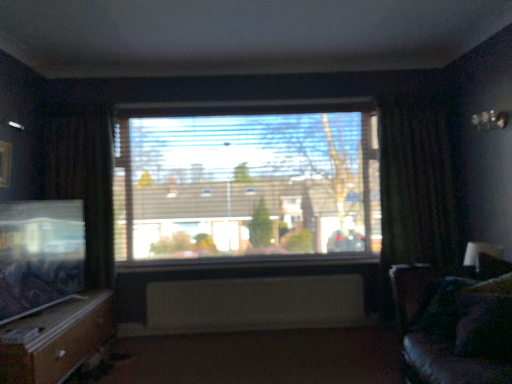
Image resolution: width=512 pixels, height=384 pixels. Identify the location of velvet dark brown couch at right. (428, 339).

In order to face dark brown fabric curtain at left, which is the 1th curtain from left to right, should I rotate leftwards or rightwards?

To face it directly, rotate left by 21.160 degrees.

I want to click on velvet dark blue pillow at lower right, so click(484, 327).

From a real-world perspective, is dark brown fabric curtain at left, which is the 1th curtain from left to right, on dark fabric curtain at right, the first curtain viewed from the right?

Indeed, from a real-world perspective, dark brown fabric curtain at left, which is the 1th curtain from left to right, stands above dark fabric curtain at right, the first curtain viewed from the right.

From the image's perspective, is dark brown fabric curtain at left, which is the 1th curtain from left to right, located beneath dark fabric curtain at right, the first curtain viewed from the right?

Yes, from the image's perspective, dark brown fabric curtain at left, which is the 1th curtain from left to right, is beneath dark fabric curtain at right, the first curtain viewed from the right.

Considering the sizes of objects dark brown fabric curtain at left, which is counted as the 2th curtain, starting from the right, and dark fabric curtain at right, the first curtain viewed from the right, in the image provided, who is thinner, dark brown fabric curtain at left, which is counted as the 2th curtain, starting from the right, or dark fabric curtain at right, the first curtain viewed from the right,?

Thinner between the two is dark fabric curtain at right, the first curtain viewed from the right.

Is dark brown fabric curtain at left, which is the 1th curtain from left to right, further to camera compared to dark fabric curtain at right, the first curtain viewed from the right?

No, dark brown fabric curtain at left, which is the 1th curtain from left to right, is closer to the viewer.

The width and height of the screenshot is (512, 384). What are the coordinates of `window on the right side of white painted wood at center` in the screenshot? It's located at (x=246, y=181).

In the scene shown: From a real-world perspective, which object rests below the other?

white painted wood at center is physically lower.

Is white painted wood at center aimed at transparent glass window at center?

Yes, white painted wood at center is oriented towards transparent glass window at center.

Is transparent glass window at center located within white painted wood at center?

No, transparent glass window at center is not a part of white painted wood at center.

Considering the positions of point (103, 321) and point (97, 278), is point (103, 321) closer or farther from the camera than point (97, 278)?

Point (103, 321) appears to be closer to the viewer than point (97, 278).

From the picture: Can dark brown fabric curtain at left, which is the 1th curtain from left to right, be found inside wooden drawer at lower left?

Actually, dark brown fabric curtain at left, which is the 1th curtain from left to right, is outside wooden drawer at lower left.

Which object is closer to the camera, wooden drawer at lower left or dark brown fabric curtain at left, which is the 1th curtain from left to right?

wooden drawer at lower left is closer to the camera.

Is wooden drawer at lower left bigger or smaller than dark brown fabric curtain at left, which is counted as the 2th curtain, starting from the right?

wooden drawer at lower left is bigger than dark brown fabric curtain at left, which is counted as the 2th curtain, starting from the right.

In the scene shown: From a real-world perspective, is velvet dark brown couch at right physically above matte black television at left?

No, from a real-world perspective, velvet dark brown couch at right is not above matte black television at left.

Is velvet dark brown couch at right to the left or to the right of matte black television at left in the image?

Based on their positions, velvet dark brown couch at right is located to the right of matte black television at left.

From the image's perspective, does velvet dark brown couch at right appear lower than matte black television at left?

Yes, from the image's perspective, velvet dark brown couch at right is below matte black television at left.

Considering the sizes of objects velvet dark brown couch at right and matte black television at left in the image provided, who is shorter, velvet dark brown couch at right or matte black television at left?

Standing shorter between the two is matte black television at left.

Which of these two, white textured radiator at center or wooden drawer at lower left, stands shorter?

white textured radiator at center.

Is white textured radiator at center far away from wooden drawer at lower left?

Yes, white textured radiator at center and wooden drawer at lower left are quite far apart.

Can you confirm if white textured radiator at center is positioned to the right of wooden drawer at lower left?

Correct, you'll find white textured radiator at center to the right of wooden drawer at lower left.

Between wooden frame at left and velvet dark blue pillow at lower right, which one appears on the left side from the viewer's perspective?

wooden frame at left is more to the left.

Is the surface of wooden frame at left in direct contact with velvet dark blue pillow at lower right?

wooden frame at left is not next to velvet dark blue pillow at lower right, and they're not touching.

Would you say wooden frame at left is outside velvet dark blue pillow at lower right?

Yes.

Considering the points (4, 155) and (483, 316), which point is in front, point (4, 155) or point (483, 316)?

Point (483, 316)

From a real-world perspective, is dark brown fabric curtain at left, which is the 1th curtain from left to right, physically located above or below white textured radiator at center?

dark brown fabric curtain at left, which is the 1th curtain from left to right, is situated higher than white textured radiator at center in the real world.

Is dark brown fabric curtain at left, which is the 1th curtain from left to right, behind white textured radiator at center?

No.

Considering the positions of points (87, 260) and (362, 302), is point (87, 260) farther from camera compared to point (362, 302)?

No, it is not.

Does dark brown fabric curtain at left, which is counted as the 2th curtain, starting from the right, have a greater width compared to white textured radiator at center?

Yes.

Where is `curtain behind the dark brown fabric curtain at left, which is counted as the 2th curtain, starting from the right`? Image resolution: width=512 pixels, height=384 pixels. curtain behind the dark brown fabric curtain at left, which is counted as the 2th curtain, starting from the right is located at coordinates (417, 178).

At what (x,y) coordinates should I click in order to perform the action: click on window sill lying in front of the transparent glass window at center. Please return your answer as a coordinate pair (x, y). The image size is (512, 384). Looking at the image, I should click on (256, 265).

Considering their positions, is matte black television at left positioned closer to wooden frame at left than velvet dark brown couch at right?

matte black television at left.

Estimate the real-world distances between objects in this image. Which object is closer to matte black television at left, velvet dark blue pillow at lower right or dark brown fabric curtain at left, which is the 1th curtain from left to right?

Among the two, dark brown fabric curtain at left, which is the 1th curtain from left to right, is located nearer to matte black television at left.

Considering their positions, is white textured radiator at center positioned closer to velvet dark brown couch at right than dark brown fabric curtain at left, which is counted as the 2th curtain, starting from the right?

white textured radiator at center.

From the image, which object appears to be nearer to matte black television at left, white painted wood at center or dark fabric curtain at right, the first curtain viewed from the right?

white painted wood at center lies closer to matte black television at left than the other object.

When comparing their distances from white textured radiator at center, does wooden frame at left or velvet dark brown couch at right seem further?

wooden frame at left lies further to white textured radiator at center than the other object.

Which object lies nearer to the anchor point transparent glass window at center, dark fabric curtain at right, the first curtain viewed from the right, or matte black television at left?

The object closer to transparent glass window at center is dark fabric curtain at right, the first curtain viewed from the right.

When comparing their distances from dark brown fabric curtain at left, which is counted as the 2th curtain, starting from the right, does transparent glass window at center or matte black television at left seem closer?

The object closer to dark brown fabric curtain at left, which is counted as the 2th curtain, starting from the right, is matte black television at left.

Considering their positions, is dark fabric curtain at right, the first curtain viewed from the right, positioned closer to matte black television at left than transparent glass window at center?

transparent glass window at center is positioned closer to the anchor matte black television at left.

This screenshot has width=512, height=384. Identify the location of pillow between velvet dark brown couch at right and white textured radiator at center along the z-axis. (484, 327).

Where is `window sill between velvet dark blue pillow at lower right and transparent glass window at center from front to back`? This screenshot has height=384, width=512. window sill between velvet dark blue pillow at lower right and transparent glass window at center from front to back is located at coordinates (256, 265).

This screenshot has width=512, height=384. I want to click on television located between wooden drawer at lower left and transparent glass window at center in the depth direction, so click(x=40, y=253).

The height and width of the screenshot is (384, 512). I want to click on window sill between wooden frame at left and velvet dark brown couch at right from left to right, so click(x=256, y=265).